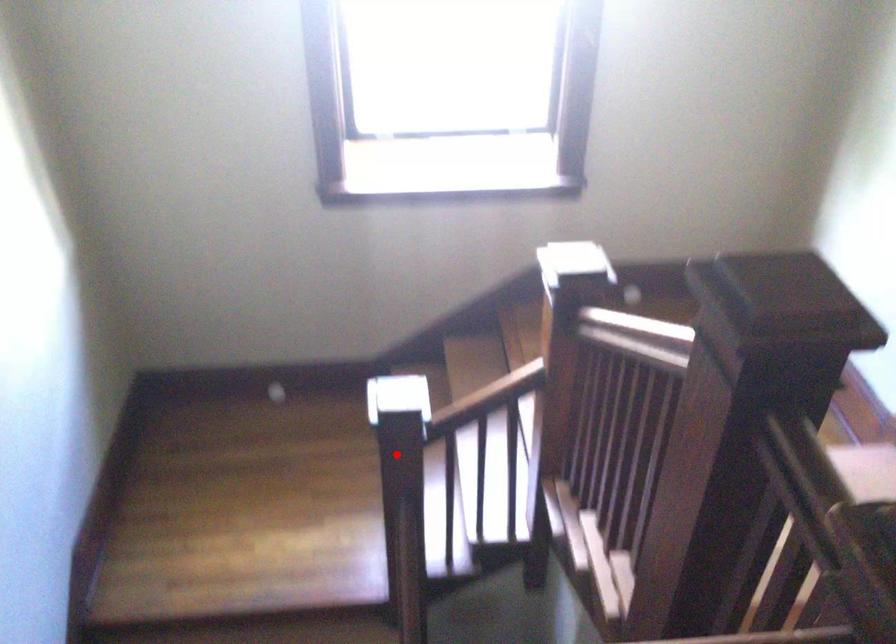
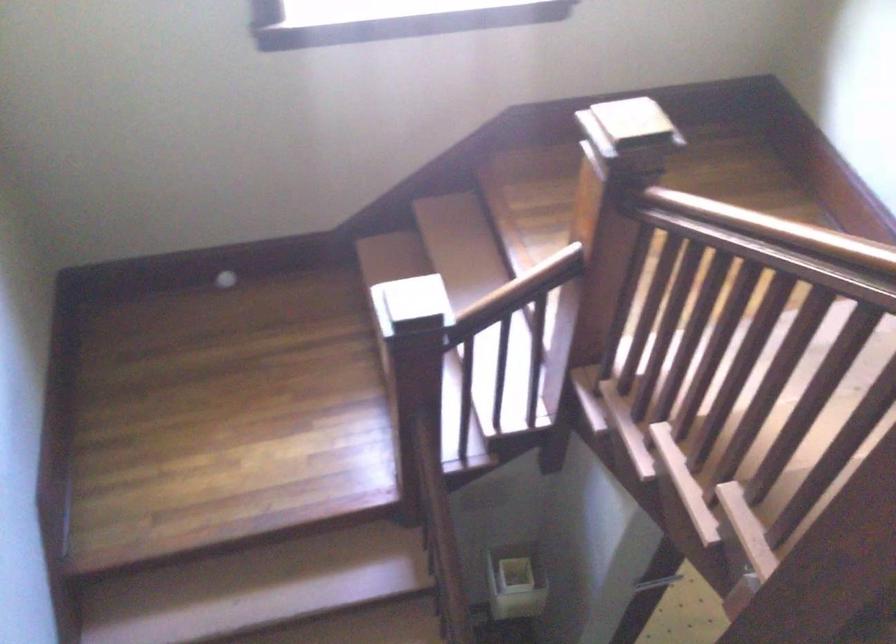
In the second image, find the point that corresponds to the highlighted location in the first image.

(410, 366)